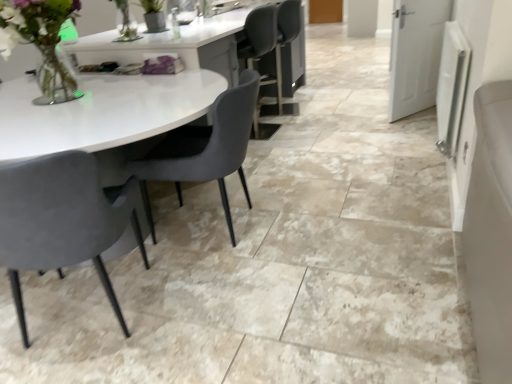
The width and height of the screenshot is (512, 384). Describe the element at coordinates (61, 220) in the screenshot. I see `matte gray chair at left, the second chair from the right` at that location.

Where is `translucent glass vase at upper left`? The height and width of the screenshot is (384, 512). translucent glass vase at upper left is located at coordinates (42, 42).

Locate an element on the screen. velvet grey chair at center, which is the 1th chair from right to left is located at coordinates (205, 148).

From the image's perspective, is translucent glass vase at upper left above or below matte gray chair at left, which is counted as the 1th chair, starting from the left?

Based on their image positions, translucent glass vase at upper left is located above matte gray chair at left, which is counted as the 1th chair, starting from the left.

Which of these two, translucent glass vase at upper left or matte gray chair at left, which is counted as the 1th chair, starting from the left, stands shorter?

With less height is translucent glass vase at upper left.

Is translucent glass vase at upper left oriented away from matte gray chair at left, the second chair from the right?

No, matte gray chair at left, the second chair from the right, is not at the back of translucent glass vase at upper left.

From the picture: From a real-world perspective, who is located higher, translucent glass vase at upper left or matte gray chair at left, the second chair from the right?

In real-world perspective, translucent glass vase at upper left is above.

In terms of height, does matte gray chair at left, which is counted as the 1th chair, starting from the left, look taller or shorter compared to velvet grey chair at center, which is the 1th chair from right to left?

Clearly, matte gray chair at left, which is counted as the 1th chair, starting from the left, is taller compared to velvet grey chair at center, which is the 1th chair from right to left.

How different are the orientations of matte gray chair at left, which is counted as the 1th chair, starting from the left, and velvet grey chair at center, the 2th chair in the left-to-right sequence, in degrees?

The facing directions of matte gray chair at left, which is counted as the 1th chair, starting from the left, and velvet grey chair at center, the 2th chair in the left-to-right sequence, are 79.3 degrees apart.

Looking at this image, from the image's perspective, would you say matte gray chair at left, which is counted as the 1th chair, starting from the left, is positioned over velvet grey chair at center, which is the 1th chair from right to left?

No, from the image's perspective, matte gray chair at left, which is counted as the 1th chair, starting from the left, is not on top of velvet grey chair at center, which is the 1th chair from right to left.

Is matte gray chair at left, the second chair from the right, thinner than velvet grey chair at center, which is the 1th chair from right to left?

Correct, the width of matte gray chair at left, the second chair from the right, is less than that of velvet grey chair at center, which is the 1th chair from right to left.

Considering the relative positions of translucent glass vase at upper left and velvet grey chair at center, the 2th chair in the left-to-right sequence, in the image provided, is translucent glass vase at upper left behind velvet grey chair at center, the 2th chair in the left-to-right sequence,?

No, translucent glass vase at upper left is in front of velvet grey chair at center, the 2th chair in the left-to-right sequence.

Is translucent glass vase at upper left looking in the opposite direction of velvet grey chair at center, the 2th chair in the left-to-right sequence?

No, translucent glass vase at upper left is not facing the opposite direction of velvet grey chair at center, the 2th chair in the left-to-right sequence.

From a real-world perspective, is translucent glass vase at upper left on velvet grey chair at center, the 2th chair in the left-to-right sequence?

Yes, from a real-world perspective, translucent glass vase at upper left is on top of velvet grey chair at center, the 2th chair in the left-to-right sequence.

In the scene shown: Is translucent glass vase at upper left not near velvet grey chair at center, which is the 1th chair from right to left?

translucent glass vase at upper left is near velvet grey chair at center, which is the 1th chair from right to left, not far away.

From the image's perspective, does velvet grey chair at center, which is the 1th chair from right to left, appear lower than matte gray chair at left, the second chair from the right?

Actually, velvet grey chair at center, which is the 1th chair from right to left, appears above matte gray chair at left, the second chair from the right, in the image.

Between velvet grey chair at center, the 2th chair in the left-to-right sequence, and matte gray chair at left, which is counted as the 1th chair, starting from the left, which one is positioned behind?

velvet grey chair at center, the 2th chair in the left-to-right sequence, is further from the camera.

Is velvet grey chair at center, which is the 1th chair from right to left, not close to matte gray chair at left, which is counted as the 1th chair, starting from the left?

No.

Can you confirm if velvet grey chair at center, the 2th chair in the left-to-right sequence, is thinner than matte gray chair at left, which is counted as the 1th chair, starting from the left?

In fact, velvet grey chair at center, the 2th chair in the left-to-right sequence, might be wider than matte gray chair at left, which is counted as the 1th chair, starting from the left.

Is the surface of matte gray chair at left, which is counted as the 1th chair, starting from the left, in direct contact with translucent glass vase at upper left?

No, matte gray chair at left, which is counted as the 1th chair, starting from the left, is not in contact with translucent glass vase at upper left.

Consider the image. Who is smaller, matte gray chair at left, the second chair from the right, or translucent glass vase at upper left?

translucent glass vase at upper left.

From the image's perspective, is matte gray chair at left, the second chair from the right, located above or below translucent glass vase at upper left?

Based on their image positions, matte gray chair at left, the second chair from the right, is located beneath translucent glass vase at upper left.

You are a GUI agent. You are given a task and a screenshot of the screen. Output one action in this format:
    pyautogui.click(x=<x>, y=<y>)
    Task: Click on the floral arrangement lying above the velvet grey chair at center, which is the 1th chair from right to left (from the image's perspective)
    
    Given the screenshot: What is the action you would take?
    pyautogui.click(x=42, y=42)

Looking at this image, from a real-world perspective, which object stands above the other?

translucent glass vase at upper left, from a real-world perspective.

Is velvet grey chair at center, which is the 1th chair from right to left, inside or outside of translucent glass vase at upper left?

The correct answer is: outside.

Considering the sizes of objects velvet grey chair at center, the 2th chair in the left-to-right sequence, and translucent glass vase at upper left in the image provided, who is wider, velvet grey chair at center, the 2th chair in the left-to-right sequence, or translucent glass vase at upper left?

velvet grey chair at center, the 2th chair in the left-to-right sequence.

This screenshot has height=384, width=512. I want to click on chair that is the 1st one when counting rightward from the translucent glass vase at upper left, so click(x=61, y=220).

Identify the location of chair above the velvet grey chair at center, the 2th chair in the left-to-right sequence (from a real-world perspective). Image resolution: width=512 pixels, height=384 pixels. (61, 220).

Considering their positions, is velvet grey chair at center, which is the 1th chair from right to left, positioned further to matte gray chair at left, which is counted as the 1th chair, starting from the left, than translucent glass vase at upper left?

The object further to matte gray chair at left, which is counted as the 1th chair, starting from the left, is translucent glass vase at upper left.

Which object lies further to the anchor point matte gray chair at left, which is counted as the 1th chair, starting from the left, translucent glass vase at upper left or velvet grey chair at center, the 2th chair in the left-to-right sequence?

translucent glass vase at upper left.

From the image, which object appears to be farther from translucent glass vase at upper left, matte gray chair at left, the second chair from the right, or velvet grey chair at center, the 2th chair in the left-to-right sequence?

matte gray chair at left, the second chair from the right, is positioned further to the anchor translucent glass vase at upper left.

Based on the photo, considering their positions, is translucent glass vase at upper left positioned closer to velvet grey chair at center, which is the 1th chair from right to left, than matte gray chair at left, which is counted as the 1th chair, starting from the left?

matte gray chair at left, which is counted as the 1th chair, starting from the left, is closer to velvet grey chair at center, which is the 1th chair from right to left.

Estimate the real-world distances between objects in this image. Which object is further from velvet grey chair at center, the 2th chair in the left-to-right sequence, matte gray chair at left, which is counted as the 1th chair, starting from the left, or translucent glass vase at upper left?

Among the two, translucent glass vase at upper left is located further to velvet grey chair at center, the 2th chair in the left-to-right sequence.

From the image, which object appears to be farther from translucent glass vase at upper left, velvet grey chair at center, which is the 1th chair from right to left, or matte gray chair at left, which is counted as the 1th chair, starting from the left?

matte gray chair at left, which is counted as the 1th chair, starting from the left, lies further to translucent glass vase at upper left than the other object.

Locate an element on the screen. The height and width of the screenshot is (384, 512). chair between translucent glass vase at upper left and matte gray chair at left, the second chair from the right, from top to bottom is located at coordinates (205, 148).